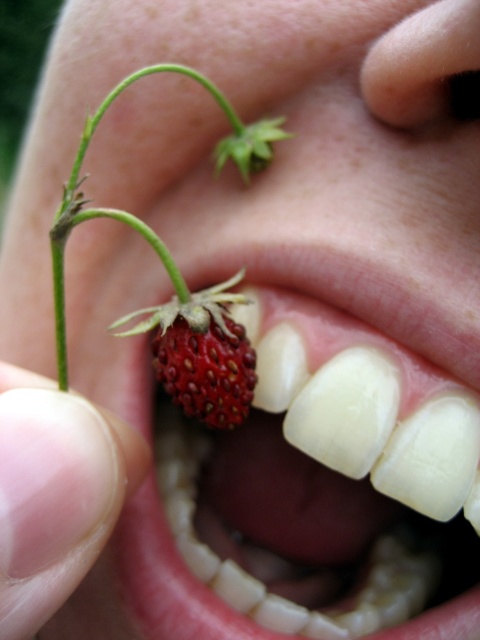
Question: Can you confirm if ripe red strawberry at mouth center is positioned to the left of smooth skin at mouth?

Choices:
 (A) yes
 (B) no

Answer: (B)

Question: Among these objects, which one is nearest to the camera?

Choices:
 (A) ripe red strawberry at mouth
 (B) ripe red strawberry at mouth center

Answer: (A)

Question: Observing the image, what is the correct spatial positioning of ripe red strawberry at mouth center in reference to smooth skin at mouth?

Choices:
 (A) right
 (B) left

Answer: (A)

Question: Which object is positioned closest to the ripe red strawberry at mouth center?

Choices:
 (A) smooth skin at mouth
 (B) ripe red strawberry at mouth

Answer: (B)

Question: Which of these objects is positioned farthest from the ripe red strawberry at mouth?

Choices:
 (A) smooth skin at mouth
 (B) ripe red strawberry at mouth center

Answer: (B)

Question: Is ripe red strawberry at mouth center below ripe red strawberry at mouth?

Choices:
 (A) yes
 (B) no

Answer: (A)